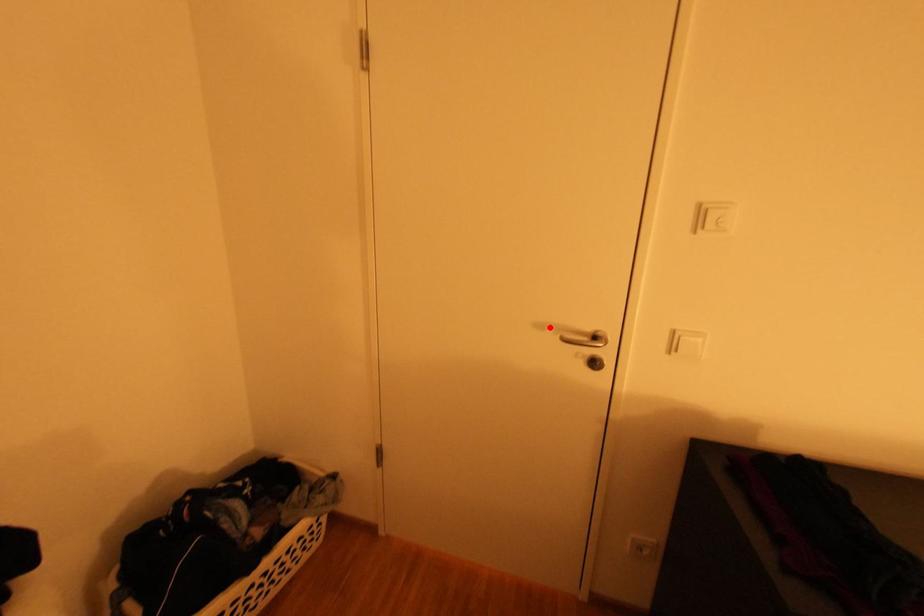
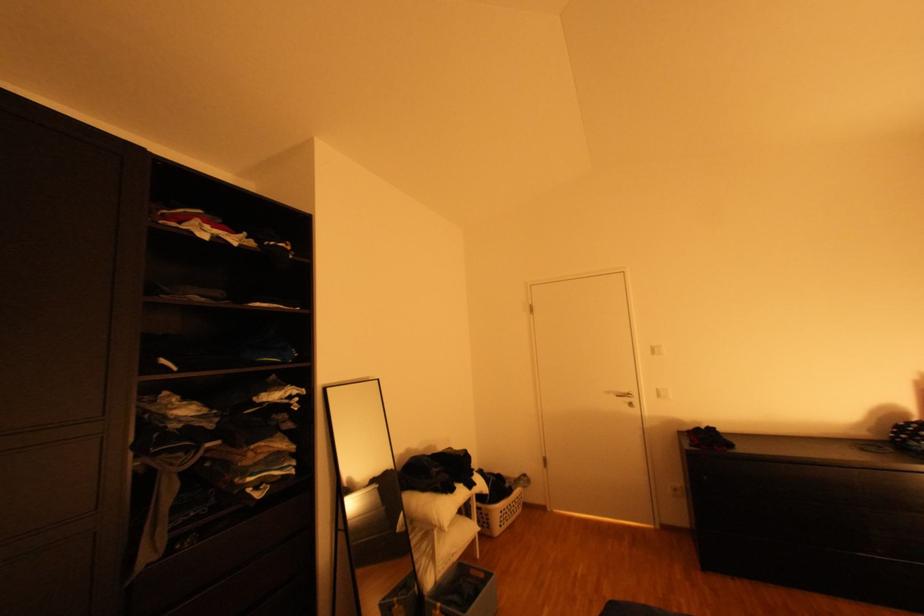
In the second image, find the point that corresponds to the highlighted location in the first image.

(617, 392)